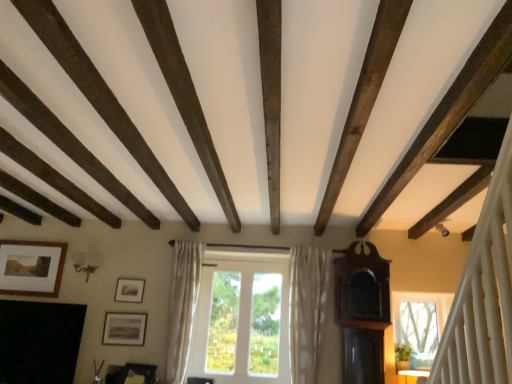
Question: From a real-world perspective, is white sheer curtain at center, the second curtain positioned from the right, below matte black picture frame at lower left, placed as the second picture frame when sorted from left to right?

Choices:
 (A) yes
 (B) no

Answer: (B)

Question: Is white sheer curtain at center, the second curtain positioned from the right, turned away from matte black picture frame at lower left, which is the 2th picture frame in right-to-left order?

Choices:
 (A) no
 (B) yes

Answer: (A)

Question: From a real-world perspective, is white sheer curtain at center, the second curtain positioned from the right, positioned over matte black picture frame at lower left, placed as the second picture frame when sorted from left to right, based on gravity?

Choices:
 (A) yes
 (B) no

Answer: (A)

Question: Is white sheer curtain at center, the second curtain positioned from the right, located outside matte black picture frame at lower left, acting as the third picture frame starting from the top?

Choices:
 (A) yes
 (B) no

Answer: (A)

Question: Is white sheer curtain at center, the first curtain from the left, further to camera compared to matte black picture frame at lower left, which is the 2th picture frame in right-to-left order?

Choices:
 (A) no
 (B) yes

Answer: (A)

Question: From the image's perspective, is white sheer curtain at center, the first curtain from the left, on matte black picture frame at lower left, which is the 2th picture frame in right-to-left order?

Choices:
 (A) no
 (B) yes

Answer: (B)

Question: Is matte black picture frame at lower left, placed as the second picture frame when sorted from left to right, at the back of white dotted fabric curtain at center, which is the 2th curtain from left to right?

Choices:
 (A) no
 (B) yes

Answer: (A)

Question: Does white dotted fabric curtain at center, which is the 2th curtain from left to right, have a greater width compared to matte black picture frame at lower left, which is the 2th picture frame in right-to-left order?

Choices:
 (A) yes
 (B) no

Answer: (A)

Question: Can you confirm if white dotted fabric curtain at center, which is the 2th curtain from left to right, is positioned to the left of matte black picture frame at lower left, placed as the second picture frame when sorted from left to right?

Choices:
 (A) no
 (B) yes

Answer: (A)

Question: Could you tell me if white dotted fabric curtain at center, which is the 2th curtain from left to right, is turned towards matte black picture frame at lower left, the first picture frame ordered from the bottom?

Choices:
 (A) yes
 (B) no

Answer: (B)

Question: Is white dotted fabric curtain at center, marked as the 1th curtain in a right-to-left arrangement, positioned beyond the bounds of matte black picture frame at lower left, placed as the second picture frame when sorted from left to right?

Choices:
 (A) yes
 (B) no

Answer: (A)

Question: From the image's perspective, does white dotted fabric curtain at center, marked as the 1th curtain in a right-to-left arrangement, appear higher than matte black picture frame at lower left, which is the 2th picture frame in right-to-left order?

Choices:
 (A) yes
 (B) no

Answer: (A)

Question: Is matte silver picture frame at center-left, acting as the 2th picture frame starting from the top, bigger than white glass window at center?

Choices:
 (A) yes
 (B) no

Answer: (B)